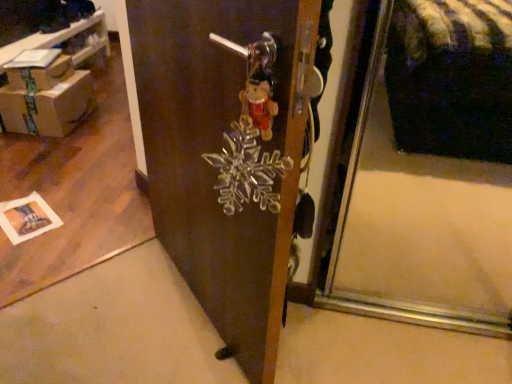
Locate an element on the screen. This screenshot has width=512, height=384. vacant area located to the right-hand side of transparent glass snowflake at center is located at coordinates (361, 319).